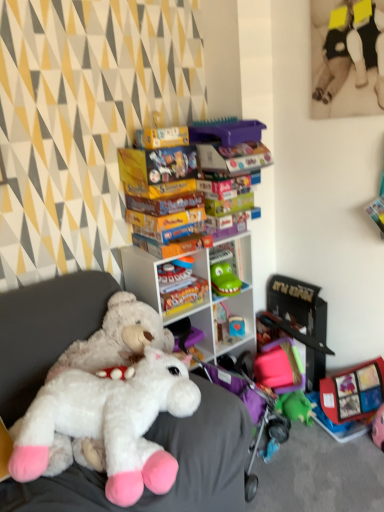
Question: From their relative heights in the image, would you say smooth plastic toy at center, which is the first toy from back to front, is taller or shorter than white plush toy at center?

Choices:
 (A) tall
 (B) short

Answer: (B)

Question: From the image's perspective, is smooth plastic toy at center, which is counted as the second toy, starting from the bottom, above or below white plush toy at center?

Choices:
 (A) below
 (B) above

Answer: (B)

Question: Estimate the real-world distances between objects in this image. Which object is closer to the green plastic toy at center?

Choices:
 (A) soft plush toy at upper right, the 1th toy positioned from the top
 (B) smooth plastic toy at center, the 3th toy from the front
 (C) white plush toy at center
 (D) black plastic toy at right, positioned as the third toy in top-to-bottom order
 (E) white plastic shelf at center

Answer: (E)

Question: Which object is the farthest from the white plastic shelf at center?

Choices:
 (A) soft plush toy at upper right, the 1th toy positioned from the top
 (B) smooth plastic toy at center, which is the first toy from back to front
 (C) white plush toy at center
 (D) black plastic toy at right, the 1th toy in the bottom-to-top sequence
 (E) green plastic toy at center

Answer: (A)